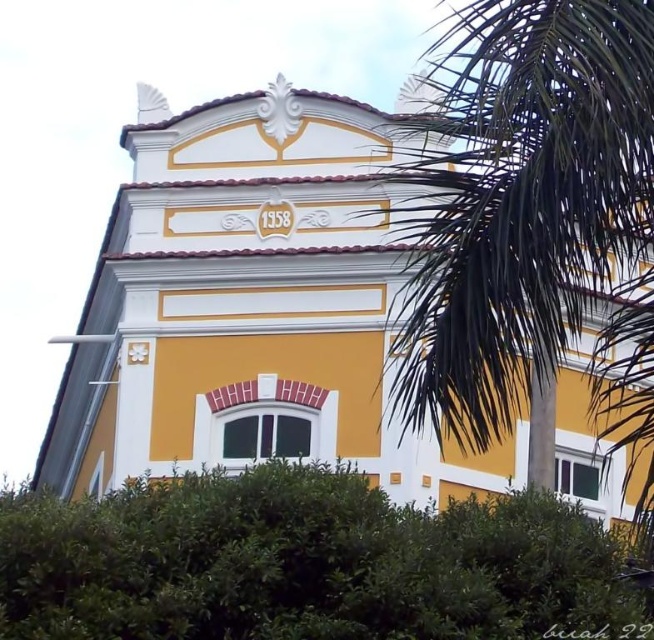
Who is higher up, yellow matte building at center or green leafy palm tree at right?

green leafy palm tree at right is above.

Does yellow matte building at center appear under green leafy palm tree at right?

Yes.

Who is more distant from viewer, (198, 244) or (627, 96)?

Positioned behind is point (198, 244).

Locate an element on the screen. yellow matte building at center is located at coordinates (247, 305).

Between point (456, 88) and point (77, 500), which one is positioned in front?

Point (456, 88) is more forward.

Can you confirm if green leafy palm tree at right is smaller than green leafy bush at lower center?

Incorrect, green leafy palm tree at right is not smaller in size than green leafy bush at lower center.

Who is more forward, (x=438, y=170) or (x=14, y=595)?

Positioned in front is point (x=14, y=595).

The image size is (654, 640). Identify the location of green leafy palm tree at right. (532, 218).

Which is behind, point (298, 209) or point (508, 513)?

The point (298, 209) is more distant.

Is yellow matte building at center taller than green leafy bush at lower center?

Correct, yellow matte building at center is much taller as green leafy bush at lower center.

Does point (254, 154) come closer to viewer compared to point (615, 538)?

No, (254, 154) is further to viewer.

Where is `yellow matte building at center`? This screenshot has height=640, width=654. yellow matte building at center is located at coordinates (247, 305).